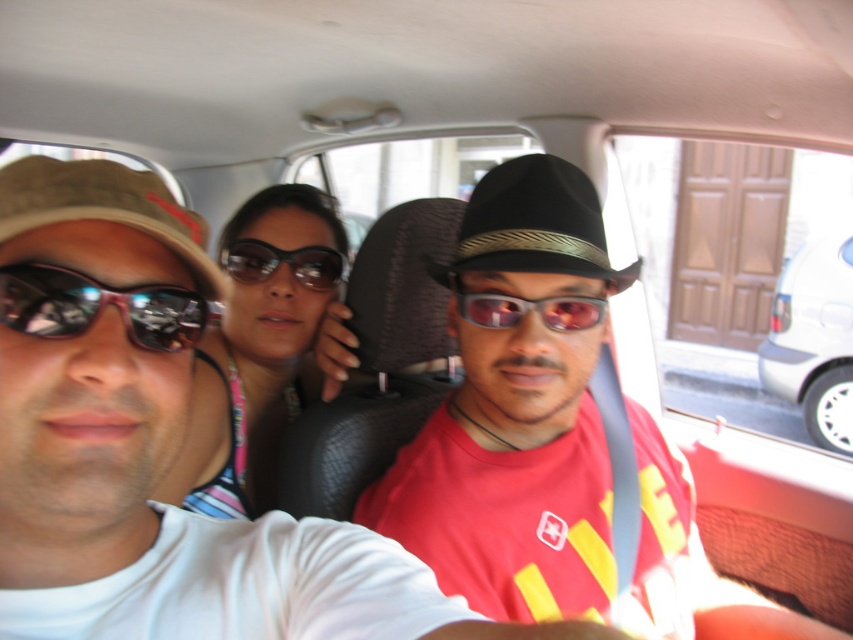
Can you confirm if matte black sunglasses at center is positioned above shiny black sunglasses at center?

No, matte black sunglasses at center is not above shiny black sunglasses at center.

Can you confirm if matte black sunglasses at center is shorter than shiny black sunglasses at center?

No, matte black sunglasses at center is not shorter than shiny black sunglasses at center.

Find the location of a particular element. matte black sunglasses at center is located at coordinates (260, 340).

Can you confirm if black felt cowboy hat at center is shorter than white glossy car at right?

Correct, black felt cowboy hat at center is not as tall as white glossy car at right.

Can you confirm if black felt cowboy hat at center is positioned above white glossy car at right?

Yes.

Is point (466, 246) positioned behind point (851, 396)?

No, it is not.

Identify the location of black felt cowboy hat at center. The height and width of the screenshot is (640, 853). (534, 225).

Does matte black sunglasses at center come behind brown fabric cowboy hat at left?

Yes.

This screenshot has height=640, width=853. What are the coordinates of `matte black sunglasses at center` in the screenshot? It's located at (260, 340).